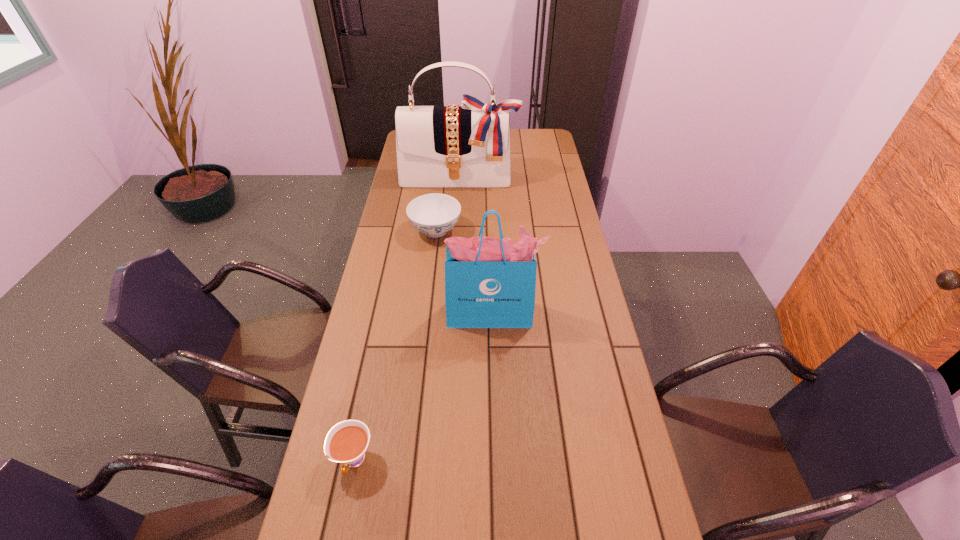
In order to click on the farthest object in this screenshot , I will do `click(469, 145)`.

The width and height of the screenshot is (960, 540). Find the location of `the tallest object`. the tallest object is located at coordinates (469, 145).

The height and width of the screenshot is (540, 960). What are the coordinates of `shopping bag` in the screenshot? It's located at (490, 282).

Where is `the third shortest object`? The width and height of the screenshot is (960, 540). the third shortest object is located at coordinates (490, 282).

Where is `the second farthest object`? the second farthest object is located at coordinates (434, 214).

At what (x,y) coordinates should I click in order to perform the action: click on chinaware. Please return your answer as a coordinate pair (x, y). The height and width of the screenshot is (540, 960). Looking at the image, I should click on (434, 214).

This screenshot has height=540, width=960. I want to click on teacup, so [x=346, y=442].

This screenshot has width=960, height=540. Find the location of `the shortest object`. the shortest object is located at coordinates (346, 442).

Find the location of `vacant space located on the front-facing side of the farthest object`. vacant space located on the front-facing side of the farthest object is located at coordinates (458, 206).

Find the location of a particular element. The height and width of the screenshot is (540, 960). vacant space positioned on the back of the second tallest object is located at coordinates (491, 255).